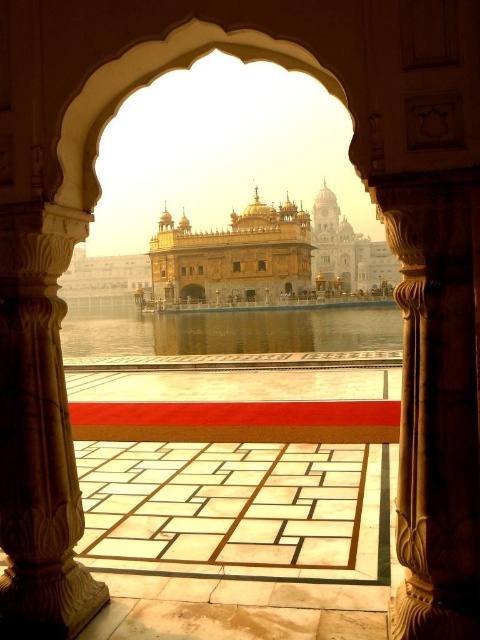
You are standing in the courtyard and want to place a decorative vase between the carved stone pillar at right and the white marble pillar at left. Which pillar should you place it closer to if you want the vase to be near the thinner pillar?

You should place the decorative vase closer to the carved stone pillar at right because it is thinner than the white marble pillar at left.

You are standing inside the ornate archway looking towards the courtyard. You see the carved stone pillar at right and the golden polished dome at center. Which object is closer to you?

The carved stone pillar at right is closer to you since it is in front of the golden polished dome at center.

You are standing in the courtyard and want to take a photo of both the carved stone pillar at right and the white marble pillar at left. Which pillar should you stand closer to in order to have both pillars fully visible in the frame?

To capture both pillars in the frame, you should stand closer to the white marble pillar at left since the carved stone pillar at right is positioned to its right, meaning it is further away from the camera position if you are centered between them. By moving closer to the white marble pillar at left, you can include both pillars within the camera frame more effectively.